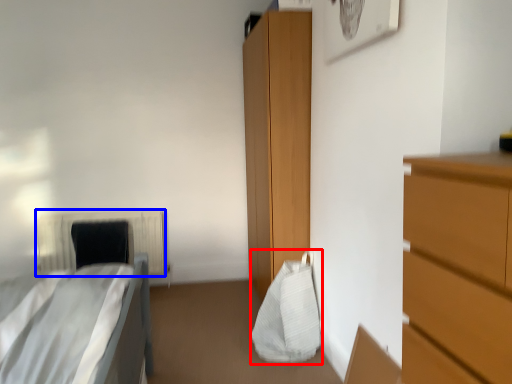
Question: Which of the following is the closest to the observer, bag (highlighted by a red box) or radiator (highlighted by a blue box)?

Choices:
 (A) bag
 (B) radiator

Answer: (A)